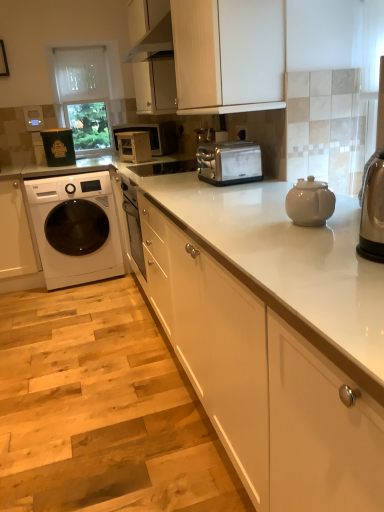
Locate an element on the screen. The image size is (384, 512). vacant area that is in front of satin silver toaster at center is located at coordinates (236, 190).